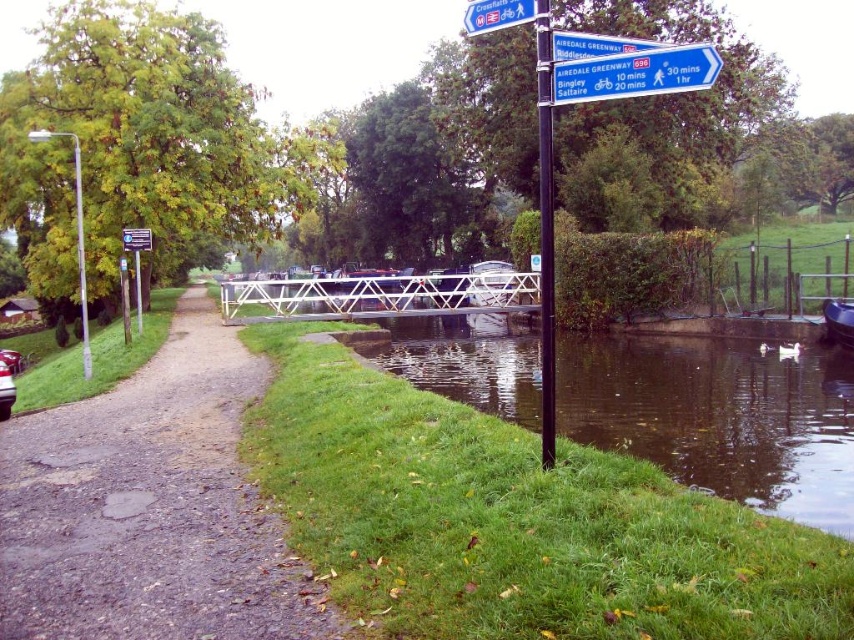
You are standing at the point marked by the coordinates point (150, 508) in the image. What type of terrain are you currently standing on?

The point (150, 508) indicates dirt gravel path at left, so you are standing on a dirt gravel path.

You are standing at the starting point of the canal path and see two points marked on the map. The first point is at coordinates point (544, 397) and the second is at point (127, 237). If you are facing the direction of the canal, which point is closer to you?

Point (544, 397) is in front of point (127, 237), so it is closer to you when facing the canal.

You are a cyclist planning to park your bike near the blue plastic boat at lower right and the brushed metal pole at left. Which of these two objects has more space around it for parking?

The brushed metal pole at left has more space around it for parking because the blue plastic boat at lower right occupies less space than the brushed metal pole at left.